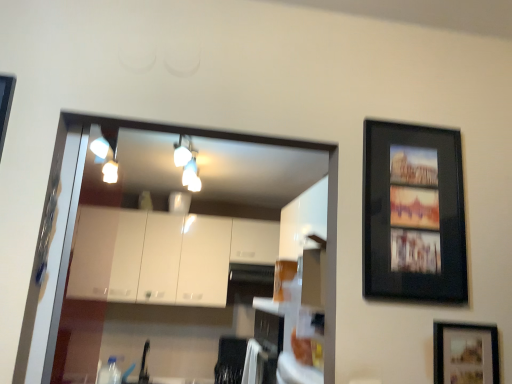
What do you see at coordinates (163, 255) in the screenshot?
I see `white glossy cabinets at center` at bounding box center [163, 255].

Find the location of a particular element. This screenshot has width=512, height=384. white glossy cabinets at center is located at coordinates click(x=163, y=255).

What is the approximate height of white glossy cabinets at center?

The height of white glossy cabinets at center is 27.70 inches.

The height and width of the screenshot is (384, 512). Find the location of `white glossy cabinets at center`. white glossy cabinets at center is located at coordinates (163, 255).